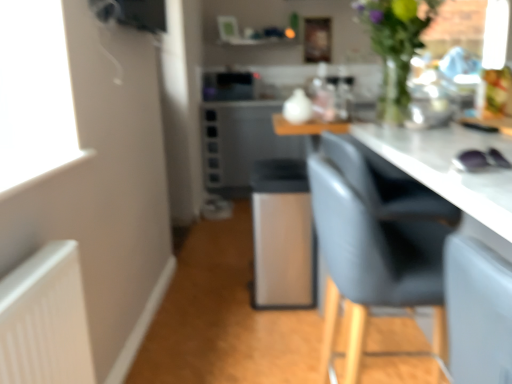
Question: Choose the correct answer: Is satin silver bar stool at center inside satin silver microwave at center or outside it?

Choices:
 (A) inside
 (B) outside

Answer: (B)

Question: From a real-world perspective, is satin silver bar stool at center positioned above or below satin silver microwave at center?

Choices:
 (A) below
 (B) above

Answer: (A)

Question: Considering the real-world distances, which object is farthest from the matte gray chair at right?

Choices:
 (A) satin silver microwave at center
 (B) satin silver bar stool at center
 (C) green glass vase at upper right

Answer: (A)

Question: Estimate the real-world distances between objects in this image. Which object is farther from the green glass vase at upper right?

Choices:
 (A) satin silver microwave at center
 (B) matte gray chair at right
 (C) satin silver bar stool at center

Answer: (A)